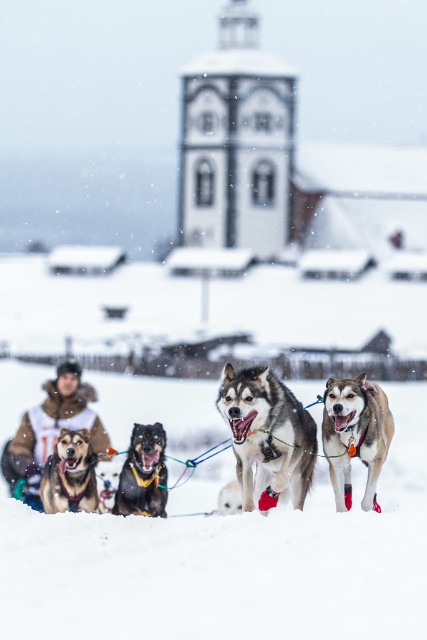
Which of these two, white fluffy snow at center or golden fur sled dog at center, stands shorter?

golden fur sled dog at center

Measure the distance from white fluffy snow at center to golden fur sled dog at center.

The distance of white fluffy snow at center from golden fur sled dog at center is 38.72 feet.

Between point (102, 365) and point (47, 492), which one is positioned behind?

The point (102, 365) is more distant.

You are a GUI agent. You are given a task and a screenshot of the screen. Output one action in this format:
    pyautogui.click(x=<x>, y=<y>)
    Task: Click on the white fluffy snow at center
    The image size is (427, 640).
    Given the screenshot: What is the action you would take?
    pyautogui.click(x=231, y=563)

Between point (38, 500) and point (82, 476), which one is positioned behind?

Point (38, 500)

I want to click on brown suede jacket at lower left, so click(49, 432).

Is golden fur sled dog at center taller than white fur dog at center?

Correct, golden fur sled dog at center is much taller as white fur dog at center.

Which is in front, point (46, 481) or point (227, 509)?

Point (46, 481)

Identify the location of golden fur sled dog at center. The height and width of the screenshot is (640, 427). (70, 474).